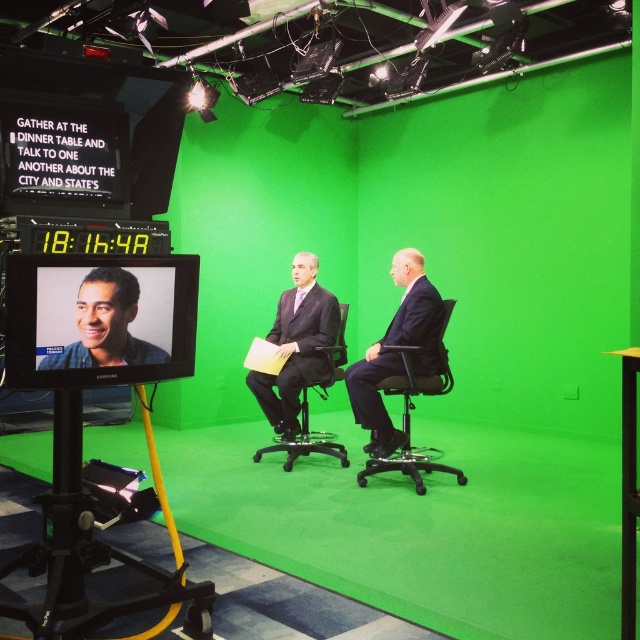
Question: Which point is closer to the camera?

Choices:
 (A) black plastic chair at right
 (B) matte black suit at center
 (C) dark suit at center

Answer: (A)

Question: Is matte black suit at center smaller than black plastic chair at right?

Choices:
 (A) yes
 (B) no

Answer: (A)

Question: Which point is farther to the camera?

Choices:
 (A) dark suit at center
 (B) matte blue shirt at left

Answer: (A)

Question: Which object is the farthest from the black plastic chair at right?

Choices:
 (A) matte black suit at center
 (B) dark suit at center

Answer: (A)

Question: Is dark suit at center below matte blue shirt at left?

Choices:
 (A) yes
 (B) no

Answer: (A)

Question: Does matte blue shirt at left appear on the left side of black plastic chair at right?

Choices:
 (A) yes
 (B) no

Answer: (A)